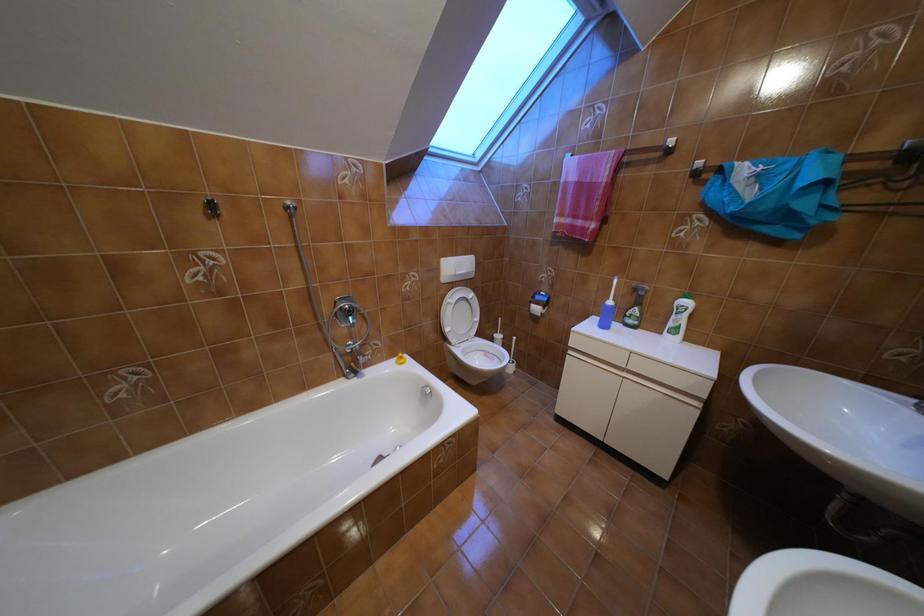
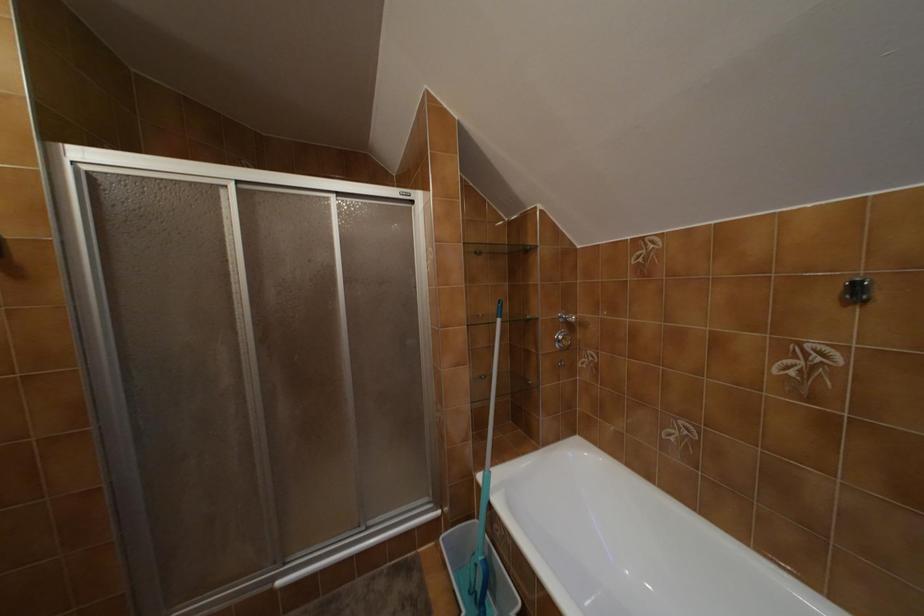
Question: The camera is either moving clockwise (left) or counter-clockwise (right) around the object. The first image is from the beginning of the video and the second image is from the end. Is the camera moving left or right when shooting the video?

Choices:
 (A) Left
 (B) Right

Answer: (B)